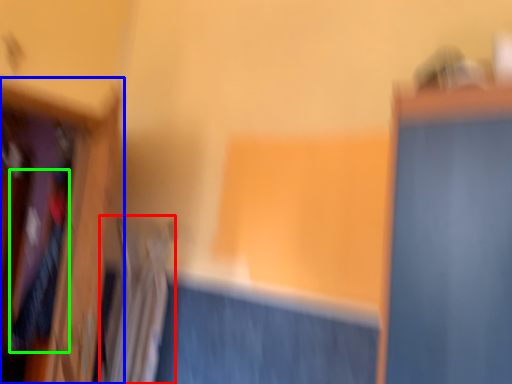
Question: Estimate the real-world distances between objects in this image. Which object is closer to radiator (highlighted by a red box), furniture (highlighted by a blue box) or clothing (highlighted by a green box)?

Choices:
 (A) furniture
 (B) clothing

Answer: (A)